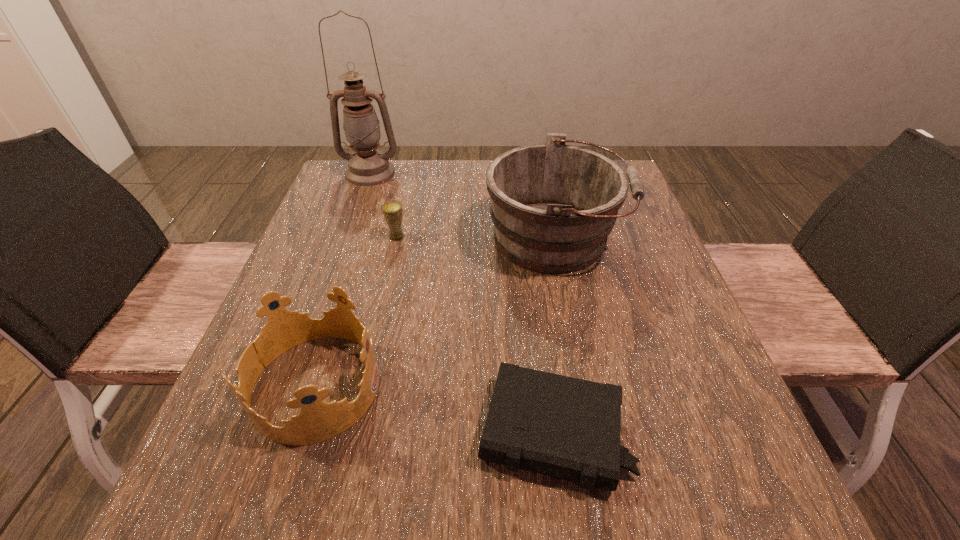
Where is `the tallest object`? The height and width of the screenshot is (540, 960). the tallest object is located at coordinates (367, 167).

Image resolution: width=960 pixels, height=540 pixels. Find the location of `the farthest object`. the farthest object is located at coordinates (367, 167).

The width and height of the screenshot is (960, 540). Identify the location of the second tallest object. (553, 206).

At what (x,y) coordinates should I click in order to perform the action: click on tiara. Please return your answer as a coordinate pair (x, y). Image resolution: width=960 pixels, height=540 pixels. Looking at the image, I should click on (318, 421).

Identify the location of straw for drinking. tap(392, 210).

Where is `Bible`? The image size is (960, 540). Bible is located at coordinates (568, 428).

The width and height of the screenshot is (960, 540). In order to click on vacant point located on the front of the tallest object in this screenshot , I will do `click(348, 235)`.

Find the location of a particular element. This screenshot has height=540, width=960. free space located on the left of the second tallest object is located at coordinates (320, 238).

Where is `vacant area situated 0.230m on the front-facing side of the tiara`? Image resolution: width=960 pixels, height=540 pixels. vacant area situated 0.230m on the front-facing side of the tiara is located at coordinates (516, 386).

Locate an element on the screen. The height and width of the screenshot is (540, 960). vacant space located 0.320m on the right of the straw for drinking is located at coordinates (541, 237).